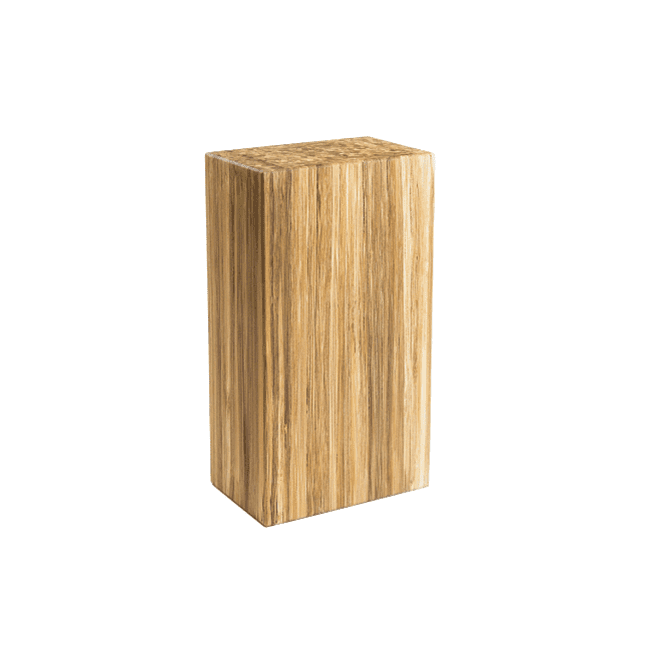
The image size is (660, 660). Find the location of `long face of butcher block`. long face of butcher block is located at coordinates (363, 270).